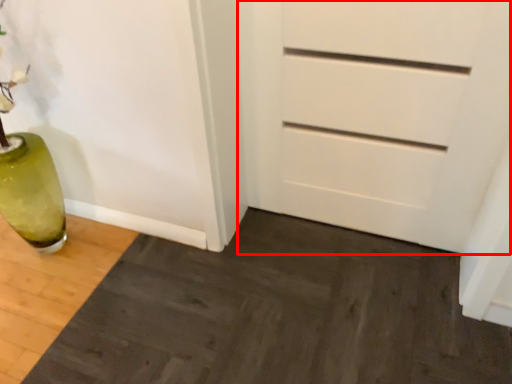
Question: From the image's perspective, what is the correct spatial positioning of chest of drawers (annotated by the red box) in reference to doormat?

Choices:
 (A) below
 (B) above

Answer: (B)